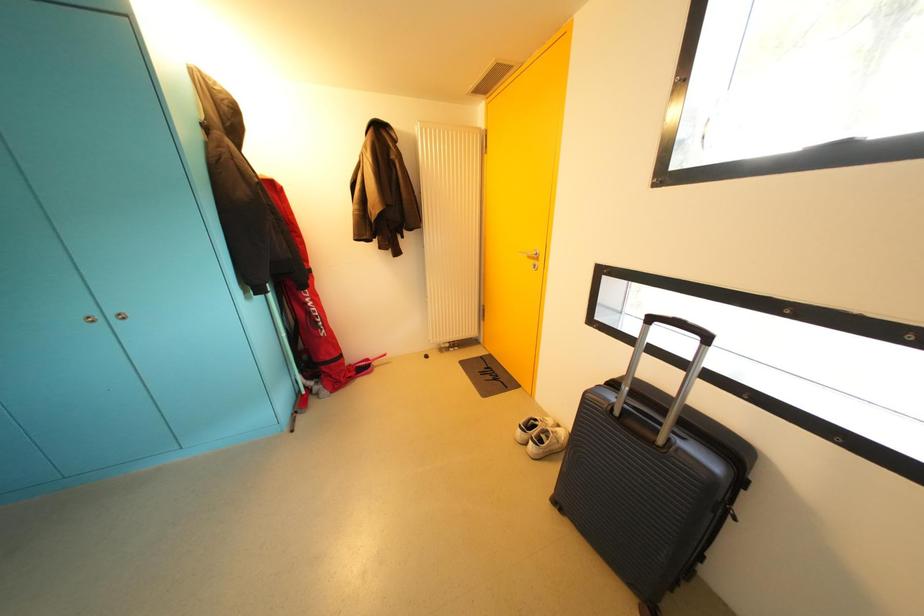
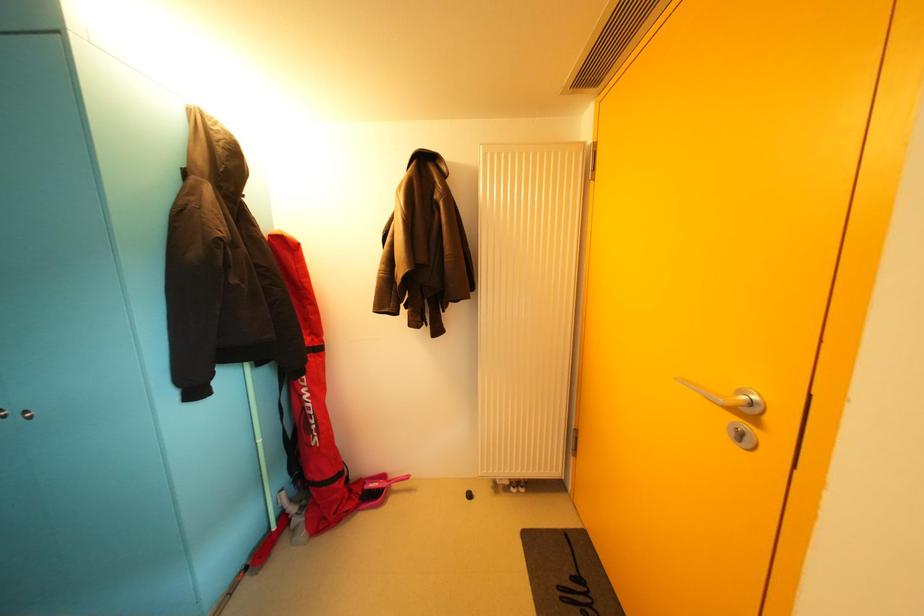
Question: The images are taken continuously from a first-person perspective. In which direction are you moving?

Choices:
 (A) Left
 (B) Right
 (C) Forward
 (D) Backward

Answer: (C)